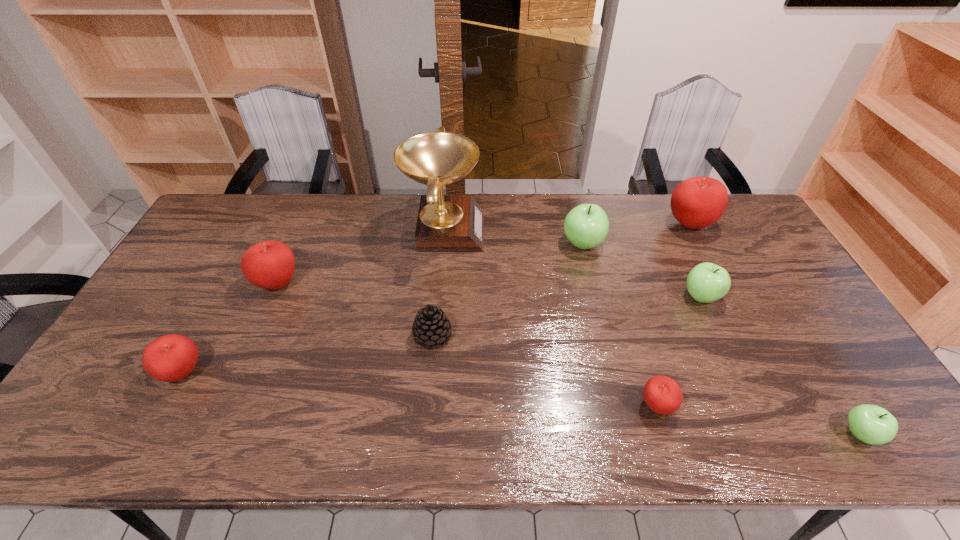
You are a GUI agent. You are given a task and a screenshot of the screen. Output one action in this format:
    pyautogui.click(x=<x>, y=<y>)
    Task: Click on the vacant space at the left edge of the desktop
    Image resolution: width=960 pixels, height=540 pixels.
    Given the screenshot: What is the action you would take?
    pyautogui.click(x=138, y=414)

Where is `free space at the right edge of the desktop`? Image resolution: width=960 pixels, height=540 pixels. free space at the right edge of the desktop is located at coordinates (825, 333).

What are the coordinates of `vacant area at the far left corner of the desktop` in the screenshot? It's located at [258, 210].

This screenshot has height=540, width=960. I want to click on unoccupied position between the third biggest red apple and the smallest red apple, so click(x=420, y=389).

This screenshot has height=540, width=960. I want to click on empty space that is in between the smallest red apple and the biggest green apple, so click(x=619, y=325).

At what (x,y) coordinates should I click in order to perform the action: click on free space between the biggest green apple and the smallest green apple. Please return your answer as a coordinate pair (x, y). This screenshot has width=960, height=540. Looking at the image, I should click on (721, 339).

Image resolution: width=960 pixels, height=540 pixels. What are the coordinates of `vacant area that lies between the second green apple from left to right and the rightmost object` in the screenshot? It's located at (780, 365).

Where is `empty space that is in between the rightmost apple and the second smallest red apple`? The width and height of the screenshot is (960, 540). empty space that is in between the rightmost apple and the second smallest red apple is located at coordinates (521, 403).

Where is `free space between the second farthest red apple and the biggest green apple`? The height and width of the screenshot is (540, 960). free space between the second farthest red apple and the biggest green apple is located at coordinates (430, 264).

Find the location of a particular element. unoccupied area between the eighth object from right to left and the second smallest red apple is located at coordinates (231, 328).